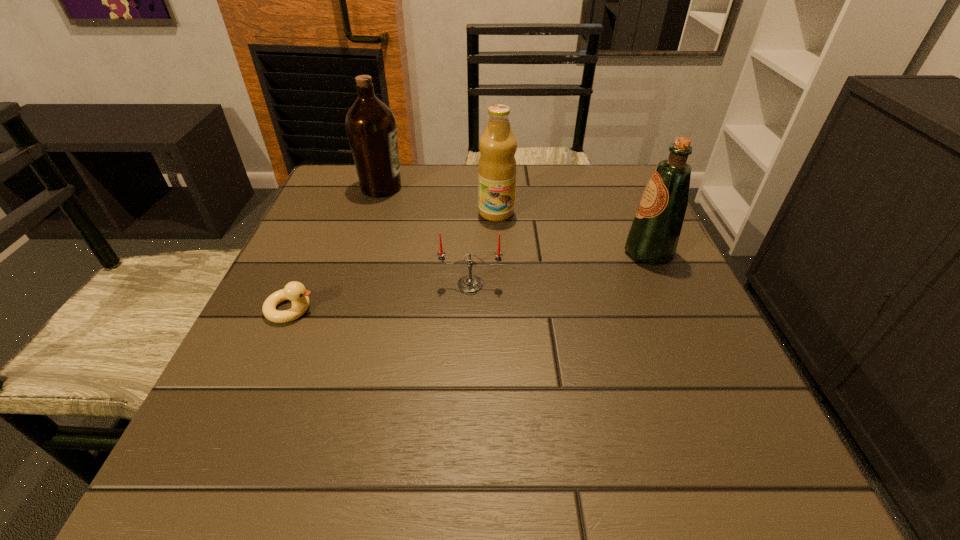
Identify the location of vacant area situated on the label of the leftmost olive oil. (559, 187).

Identify the location of free space located on the front-facing side of the nearest olive oil. This screenshot has height=540, width=960. (575, 252).

Locate an element on the screen. The height and width of the screenshot is (540, 960). vacant region located 0.070m on the front-facing side of the nearest olive oil is located at coordinates (589, 252).

Image resolution: width=960 pixels, height=540 pixels. Find the location of `blank space located 0.250m on the front-facing side of the nearest olive oil`. blank space located 0.250m on the front-facing side of the nearest olive oil is located at coordinates (503, 252).

Find the location of a particular element. This screenshot has height=540, width=960. free space located 0.230m on the label of the second farthest object is located at coordinates (500, 293).

Where is `vacant region located 0.130m on the front-facing side of the second shortest object`? vacant region located 0.130m on the front-facing side of the second shortest object is located at coordinates tap(469, 347).

Find the location of a particular element. This screenshot has height=540, width=960. blank space located at the beak of the nearest object is located at coordinates (499, 309).

Locate an element on the screen. The width and height of the screenshot is (960, 540). olive oil located at the left edge is located at coordinates point(371,127).

The image size is (960, 540). I want to click on duckling located in the left edge section of the desktop, so click(295, 291).

Find the location of a particular element. The image size is (960, 540). object that is at the right edge is located at coordinates (654, 234).